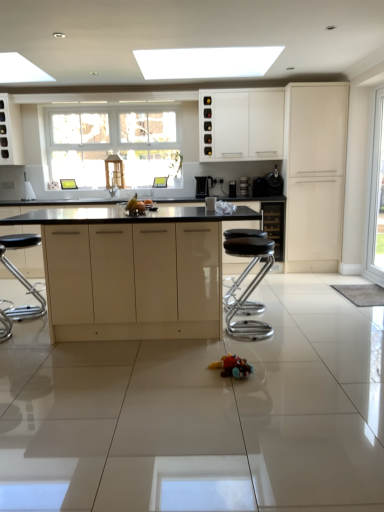
What are the coordinates of `metallic silver coffee machine at center, the 3th appliance in the right-to-left sequence` in the screenshot? It's located at (244, 186).

What is the approximate height of glossy white cabinets at center, which is the first cabinetry from left to right?

It is 36.18 inches.

Describe the element at coordinates (204, 185) in the screenshot. The image size is (384, 512). I see `black plastic coffee machine at center` at that location.

This screenshot has width=384, height=512. What do you see at coordinates (241, 125) in the screenshot?
I see `white glossy cabinet at upper center, acting as the 3th cabinetry starting from the right` at bounding box center [241, 125].

You are a GUI agent. You are given a task and a screenshot of the screen. Output one action in this format:
    pyautogui.click(x=<x>, y=<y>)
    Task: Click on the black glass wine cooler at center, acting as the 3th cabinetry starting from the left
    This screenshot has width=384, height=512.
    Given the screenshot: What is the action you would take?
    pyautogui.click(x=274, y=226)

In the scene shown: Is glossy white cabinets at center, which is the fourth cabinetry in back-to-front order, behind white glossy cabinet at upper center, acting as the 3th cabinetry starting from the right?

No, it is not.

From the image's perspective, which one is positioned lower, glossy white cabinets at center, which is the fourth cabinetry in back-to-front order, or white glossy cabinet at upper center, acting as the 3th cabinetry starting from the right?

glossy white cabinets at center, which is the fourth cabinetry in back-to-front order.

Does glossy white cabinets at center, which is the first cabinetry from left to right, have a lesser height compared to white glossy cabinet at upper center, acting as the 3th cabinetry starting from the right?

No.

From a real-world perspective, is transparent glass door at right physically located above or below black plastic coffee maker at center, which is counted as the 4th appliance, starting from the right?

Clearly, from a real-world perspective, transparent glass door at right is above black plastic coffee maker at center, which is counted as the 4th appliance, starting from the right.

You are a GUI agent. You are given a task and a screenshot of the screen. Output one action in this format:
    pyautogui.click(x=<x>, y=<y>)
    Task: Click on the glass door in front of the black plastic coffee maker at center, which is counted as the 4th appliance, starting from the right
    The height and width of the screenshot is (512, 384).
    Given the screenshot: What is the action you would take?
    pyautogui.click(x=376, y=199)

Which of these two, transparent glass door at right or black plastic coffee maker at center, which is counted as the 4th appliance, starting from the right, is wider?

transparent glass door at right.

Is black glossy coffee maker at right, placed as the 1th appliance when sorted from right to left, turned away from matte white cabinet at right, which is the first cabinetry in right-to-left order?

black glossy coffee maker at right, placed as the 1th appliance when sorted from right to left, is not turned away from matte white cabinet at right, which is the first cabinetry in right-to-left order.

From a real-world perspective, is black glossy coffee maker at right, acting as the 4th appliance starting from the left, physically above matte white cabinet at right, the 4th cabinetry in the left-to-right sequence?

Correct, in the physical world, black glossy coffee maker at right, acting as the 4th appliance starting from the left, is higher than matte white cabinet at right, the 4th cabinetry in the left-to-right sequence.

Can you tell me how much black glossy coffee maker at right, acting as the 4th appliance starting from the left, and matte white cabinet at right, which ranks as the third cabinetry in back-to-front order, differ in facing direction?

The angular difference between black glossy coffee maker at right, acting as the 4th appliance starting from the left, and matte white cabinet at right, which ranks as the third cabinetry in back-to-front order, is 2.79 degrees.

The height and width of the screenshot is (512, 384). Identify the location of appliance above the matte white cabinet at right, which is the first cabinetry in right-to-left order (from a real-world perspective). (274, 183).

Find the location of a particular element. toy below the black plastic coffee maker at center, the first appliance positioned from the left (from a real-world perspective) is located at coordinates (232, 366).

Does multicolored plastic toy at center lie behind black plastic coffee maker at center, which is counted as the 4th appliance, starting from the right?

No, multicolored plastic toy at center is closer to the viewer.

Is multicolored plastic toy at center surrounding black plastic coffee maker at center, which is counted as the 4th appliance, starting from the right?

No, black plastic coffee maker at center, which is counted as the 4th appliance, starting from the right, is not inside multicolored plastic toy at center.

Who is smaller, multicolored plastic toy at center or black plastic coffee maker at center, which is counted as the 4th appliance, starting from the right?

With smaller size is black plastic coffee maker at center, which is counted as the 4th appliance, starting from the right.

Does black plastic coffee machine at center have a lesser width compared to white glossy cabinet at upper center, the third cabinetry positioned from the front?

Correct, the width of black plastic coffee machine at center is less than that of white glossy cabinet at upper center, the third cabinetry positioned from the front.

Considering the relative positions of black plastic coffee machine at center and white glossy cabinet at upper center, the second cabinetry in the left-to-right sequence, in the image provided, is black plastic coffee machine at center in front of white glossy cabinet at upper center, the second cabinetry in the left-to-right sequence,?

No, it is behind white glossy cabinet at upper center, the second cabinetry in the left-to-right sequence.

From the image's perspective, is black plastic coffee machine at center positioned above or below white glossy cabinet at upper center, acting as the 3th cabinetry starting from the right?

black plastic coffee machine at center is situated lower than white glossy cabinet at upper center, acting as the 3th cabinetry starting from the right, in the image.

Does black plastic coffee machine at center have a lesser height compared to white glossy cabinet at upper center, the second cabinetry in the left-to-right sequence?

Correct, black plastic coffee machine at center is not as tall as white glossy cabinet at upper center, the second cabinetry in the left-to-right sequence.

Does black plastic coffee maker at center, which is counted as the 4th appliance, starting from the right, have a greater height compared to multicolored plastic toy at center?

Yes.

From the image's perspective, which object appears higher, black plastic coffee maker at center, which is counted as the 4th appliance, starting from the right, or multicolored plastic toy at center?

black plastic coffee maker at center, which is counted as the 4th appliance, starting from the right, is shown above in the image.

Who is bigger, black plastic coffee maker at center, the first appliance positioned from the left, or multicolored plastic toy at center?

multicolored plastic toy at center is bigger.

What's the angular difference between black plastic coffee maker at center, the first appliance positioned from the left, and multicolored plastic toy at center's facing directions?

They differ by 1.03 degrees in their facing directions.

Could you tell me if transparent glass door at right is facing black glossy coffee maker at right, acting as the 4th appliance starting from the left?

No, transparent glass door at right is not facing towards black glossy coffee maker at right, acting as the 4th appliance starting from the left.

From a real-world perspective, which object stands above the other?

black glossy coffee maker at right, acting as the 4th appliance starting from the left.

How distant is transparent glass door at right from black glossy coffee maker at right, placed as the 1th appliance when sorted from right to left?

transparent glass door at right and black glossy coffee maker at right, placed as the 1th appliance when sorted from right to left, are 3.83 feet apart.

Does transparent glass door at right have a smaller size compared to black glossy coffee maker at right, placed as the 1th appliance when sorted from right to left?

Actually, transparent glass door at right might be larger than black glossy coffee maker at right, placed as the 1th appliance when sorted from right to left.

The image size is (384, 512). Find the location of `cabinetry that is the 1st one when counting rightward from the glossy white cabinets at center, which is the first cabinetry from left to right`. cabinetry that is the 1st one when counting rightward from the glossy white cabinets at center, which is the first cabinetry from left to right is located at coordinates (241, 125).

In the image, there is a black plastic coffee maker at center, the first appliance positioned from the left. Where is `glass door below it (from the image's perspective)`? glass door below it (from the image's perspective) is located at coordinates (376, 199).

Based on their spatial positions, is white glossy cabinet at upper center, which appears as the 2th cabinetry when viewed from the back, or black plastic coffee machine at center further from matte white cabinet at right, the 4th cabinetry in the left-to-right sequence?

black plastic coffee machine at center lies further to matte white cabinet at right, the 4th cabinetry in the left-to-right sequence, than the other object.

Estimate the real-world distances between objects in this image. Which object is further from black glass wine cooler at center, which appears as the 4th cabinetry when viewed from the front, matte white cabinet at right, which is the first cabinetry in right-to-left order, or black glossy coffee maker at right, placed as the 1th appliance when sorted from right to left?

Based on the image, matte white cabinet at right, which is the first cabinetry in right-to-left order, appears to be further to black glass wine cooler at center, which appears as the 4th cabinetry when viewed from the front.

Considering their positions, is glossy white cabinets at center, positioned as the 4th cabinetry in right-to-left order, positioned closer to multicolored plastic toy at center than white glossy cabinet at upper center, which appears as the 2th cabinetry when viewed from the back?

glossy white cabinets at center, positioned as the 4th cabinetry in right-to-left order, is positioned closer to the anchor multicolored plastic toy at center.

Estimate the real-world distances between objects in this image. Which object is further from multicolored plastic toy at center, black glass wine cooler at center, which appears as the 4th cabinetry when viewed from the front, or black glossy coffee maker at right, acting as the 4th appliance starting from the left?

black glossy coffee maker at right, acting as the 4th appliance starting from the left, is further to multicolored plastic toy at center.

When comparing their distances from black glossy coffee machine at center, marked as the 3th appliance in a left-to-right arrangement, does white glossy cabinet at upper center, acting as the 3th cabinetry starting from the right, or matte white cabinet at right, acting as the 2th cabinetry starting from the front, seem closer?

matte white cabinet at right, acting as the 2th cabinetry starting from the front, lies closer to black glossy coffee machine at center, marked as the 3th appliance in a left-to-right arrangement, than the other object.

Estimate the real-world distances between objects in this image. Which object is closer to black glass wine cooler at center, acting as the 3th cabinetry starting from the left, matte white cabinet at right, which is the first cabinetry in right-to-left order, or glossy white cabinets at center, which is the fourth cabinetry in back-to-front order?

Based on the image, matte white cabinet at right, which is the first cabinetry in right-to-left order, appears to be nearer to black glass wine cooler at center, acting as the 3th cabinetry starting from the left.

When comparing their distances from black plastic coffee machine at center, does black glossy coffee maker at right, acting as the 4th appliance starting from the left, or matte white cabinet at right, acting as the 2th cabinetry starting from the front, seem closer?

black glossy coffee maker at right, acting as the 4th appliance starting from the left, is positioned closer to the anchor black plastic coffee machine at center.

Considering their positions, is black glossy coffee machine at center, marked as the 3th appliance in a left-to-right arrangement, positioned closer to matte white cabinet at right, which ranks as the third cabinetry in back-to-front order, than black plastic coffee maker at center, which is counted as the 4th appliance, starting from the right?

black glossy coffee machine at center, marked as the 3th appliance in a left-to-right arrangement, lies closer to matte white cabinet at right, which ranks as the third cabinetry in back-to-front order, than the other object.

Where is `appliance positioned between black glossy coffee maker at right, acting as the 4th appliance starting from the left, and metallic silver coffee machine at center, positioned as the second appliance in left-to-right order, from near to far`? appliance positioned between black glossy coffee maker at right, acting as the 4th appliance starting from the left, and metallic silver coffee machine at center, positioned as the second appliance in left-to-right order, from near to far is located at coordinates (260, 187).

Where is `glass door between multicolored plastic toy at center and metallic silver coffee machine at center, positioned as the second appliance in left-to-right order, in the front-back direction`? This screenshot has width=384, height=512. glass door between multicolored plastic toy at center and metallic silver coffee machine at center, positioned as the second appliance in left-to-right order, in the front-back direction is located at coordinates (376, 199).

Locate an element on the screen. Image resolution: width=384 pixels, height=512 pixels. cabinetry located between black glossy coffee maker at right, placed as the 1th appliance when sorted from right to left, and transparent glass door at right in the left-right direction is located at coordinates (315, 175).

Find the location of `toy between glossy white cabinets at center, which is the fourth cabinetry in back-to-front order, and transparent glass door at right from left to right`. toy between glossy white cabinets at center, which is the fourth cabinetry in back-to-front order, and transparent glass door at right from left to right is located at coordinates (232, 366).